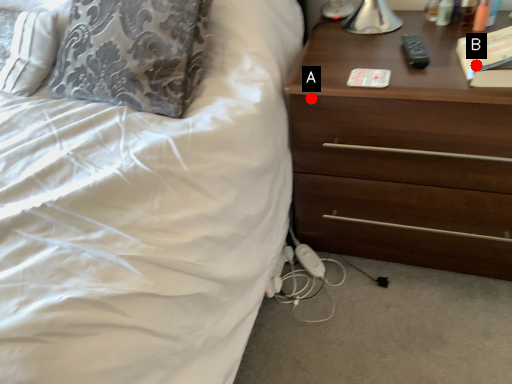
Question: Two points are circled on the image, labeled by A and B beside each circle. Which point is closer to the camera?

Choices:
 (A) A is closer
 (B) B is closer

Answer: (B)